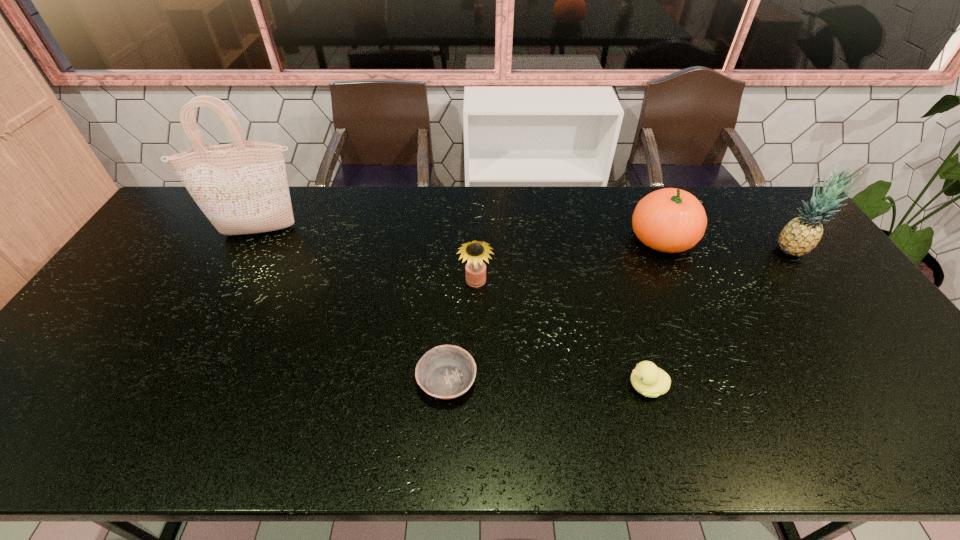
Where is `vacant point located between the shopping bag and the bowl`? The width and height of the screenshot is (960, 540). vacant point located between the shopping bag and the bowl is located at coordinates (353, 306).

Where is `unoccupied area between the shortest object and the third object from right to left`? unoccupied area between the shortest object and the third object from right to left is located at coordinates (546, 383).

I want to click on free spot between the pineapple and the sunflower, so click(x=634, y=266).

Identify which object is the second nearest to the tallest object. Please provide its 2D coordinates. Your answer should be formatted as a tuple, i.e. [(x, y)], where the tuple contains the x and y coordinates of a point satisfying the conditions above.

[(445, 372)]

Locate an element on the screen. This screenshot has height=540, width=960. object that ranks as the fourth closest to the leftmost object is located at coordinates (671, 220).

Locate an element on the screen. The width and height of the screenshot is (960, 540). free space that satisfies the following two spatial constraints: 1. on the back side of the second object from right to left; 2. on the right side of the bowl is located at coordinates (455, 238).

Find the location of a particular element. vacant space that satisfies the following two spatial constraints: 1. on the front side of the pumpkin; 2. at the beak of the third object from right to left is located at coordinates (727, 386).

Where is `vacant space that satisfies the following two spatial constraints: 1. on the front side of the tallest object; 2. on the right side of the second tallest object`? This screenshot has height=540, width=960. vacant space that satisfies the following two spatial constraints: 1. on the front side of the tallest object; 2. on the right side of the second tallest object is located at coordinates (251, 249).

This screenshot has width=960, height=540. Find the location of `blank area in the image that satisfies the following two spatial constraints: 1. on the front side of the bowl; 2. on the left side of the shopping bag`. blank area in the image that satisfies the following two spatial constraints: 1. on the front side of the bowl; 2. on the left side of the shopping bag is located at coordinates [x=180, y=381].